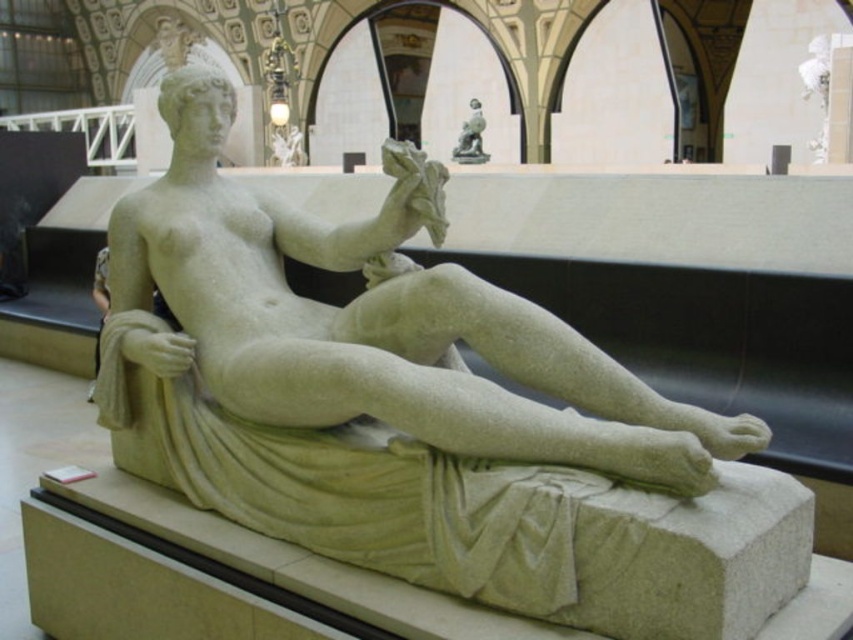
Question: Which point appears closest to the camera in this image?

Choices:
 (A) (456, 154)
 (B) (357, 388)

Answer: (B)

Question: Which of the following is the closest to the observer?

Choices:
 (A) (480, 132)
 (B) (345, 262)

Answer: (B)

Question: Is smooth stone statue at center smaller than polished bronze statue at upper center?

Choices:
 (A) no
 (B) yes

Answer: (A)

Question: Can you confirm if smooth stone statue at center is smaller than polished bronze statue at upper center?

Choices:
 (A) no
 (B) yes

Answer: (A)

Question: Does smooth stone statue at center have a smaller size compared to polished bronze statue at upper center?

Choices:
 (A) yes
 (B) no

Answer: (B)